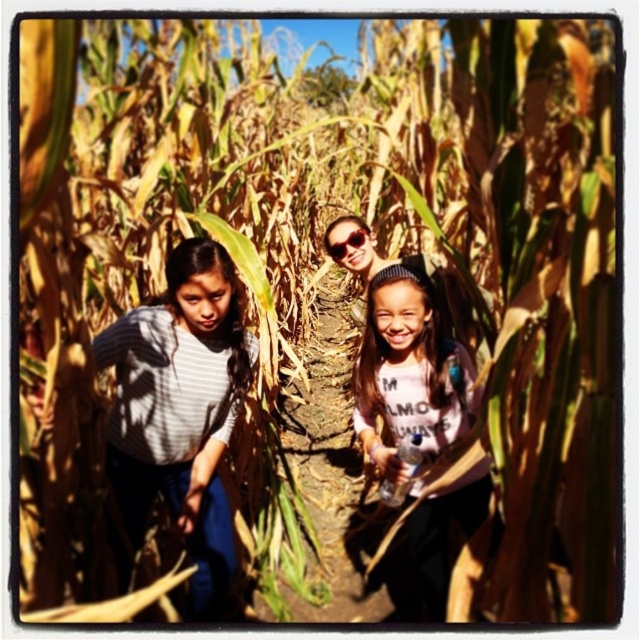
Question: Based on their relative distances, which object is nearer to the gray striped shirt at left?

Choices:
 (A) white cotton shirt at center
 (B) sunglasses at center

Answer: (A)

Question: Is gray striped shirt at left above sunglasses at center?

Choices:
 (A) yes
 (B) no

Answer: (B)

Question: Does white cotton shirt at center appear on the left side of sunglasses at center?

Choices:
 (A) yes
 (B) no

Answer: (B)

Question: Considering the real-world distances, which object is closest to the gray striped shirt at left?

Choices:
 (A) white cotton shirt at center
 (B) sunglasses at center

Answer: (A)

Question: Which point appears closest to the camera in this image?

Choices:
 (A) (356, 227)
 (B) (460, 348)
 (C) (228, 275)

Answer: (C)

Question: Does white cotton shirt at center have a smaller size compared to sunglasses at center?

Choices:
 (A) yes
 (B) no

Answer: (B)